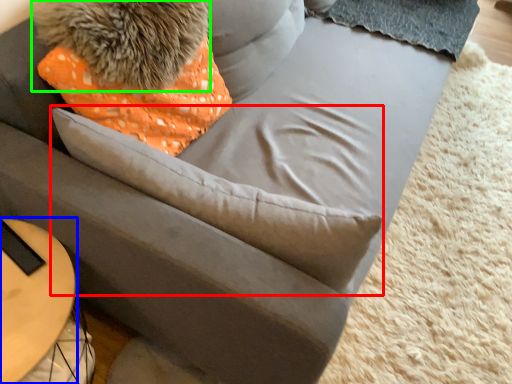
Question: Based on their relative distances, which object is farther from throw pillow (highlighted by a red box)? Choose from table (highlighted by a blue box) and animal (highlighted by a green box).

Choices:
 (A) table
 (B) animal

Answer: (A)